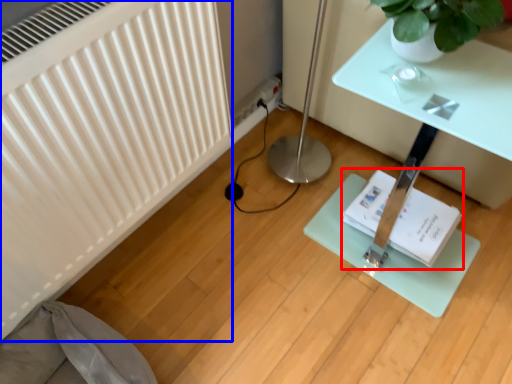
Question: Which of the following is the farthest to the observer, book (highlighted by a red box) or radiator (highlighted by a blue box)?

Choices:
 (A) book
 (B) radiator

Answer: (A)